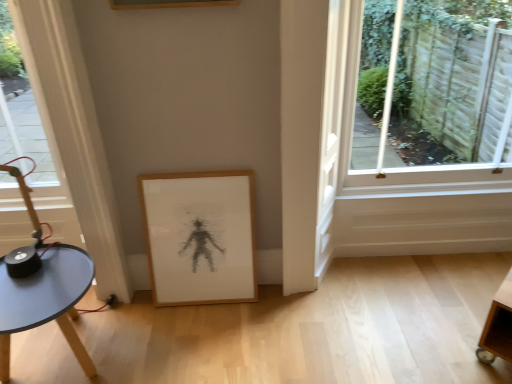
Find the location of `vacant space to the right of matte blue table at lower left`. vacant space to the right of matte blue table at lower left is located at coordinates (166, 349).